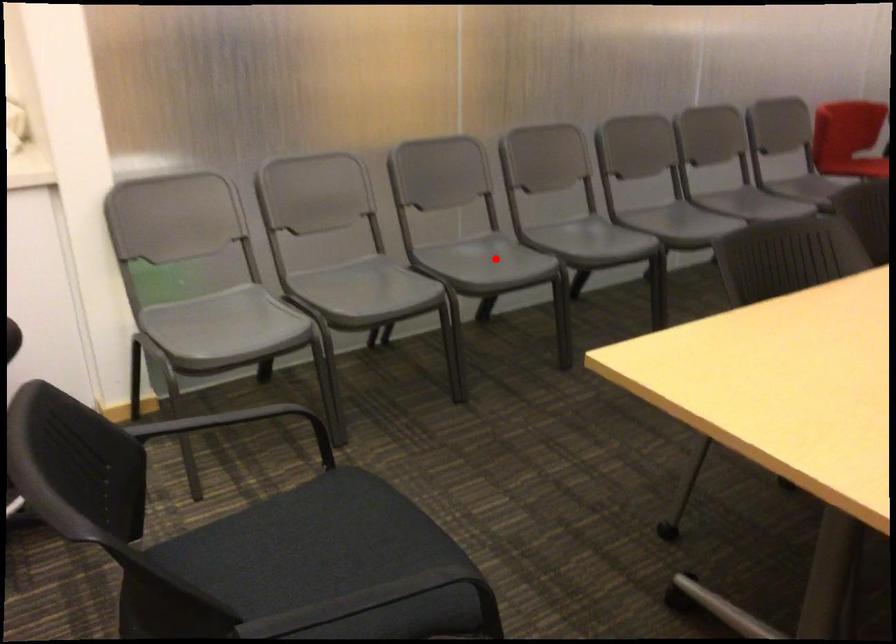
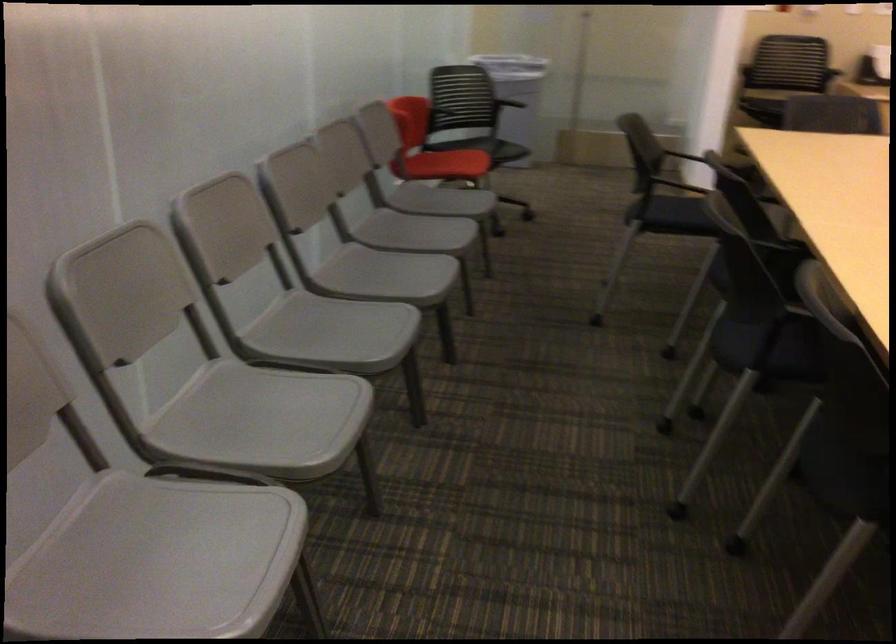
The point at the highlighted location is marked in the first image. Where is the corresponding point in the second image?

(263, 420)